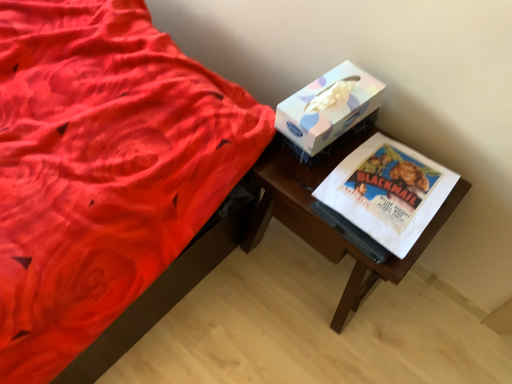
Question: Is white paper at right looking in the opposite direction of wooden table at right?

Choices:
 (A) no
 (B) yes

Answer: (A)

Question: Is there a large distance between white paper at right and wooden table at right?

Choices:
 (A) no
 (B) yes

Answer: (A)

Question: Can you confirm if white paper at right is bigger than wooden table at right?

Choices:
 (A) yes
 (B) no

Answer: (B)

Question: From a real-world perspective, is white paper at right over wooden table at right?

Choices:
 (A) yes
 (B) no

Answer: (A)

Question: From a real-world perspective, is white paper at right located beneath wooden table at right?

Choices:
 (A) yes
 (B) no

Answer: (B)

Question: In the image, is pastel paper tissue box at upper right on the left side or the right side of wooden table at right?

Choices:
 (A) left
 (B) right

Answer: (A)

Question: Do you think pastel paper tissue box at upper right is within wooden table at right, or outside of it?

Choices:
 (A) inside
 (B) outside

Answer: (B)

Question: From a real-world perspective, relative to wooden table at right, is pastel paper tissue box at upper right vertically above or below?

Choices:
 (A) below
 (B) above

Answer: (B)

Question: Is point (321, 135) closer or farther from the camera than point (366, 283)?

Choices:
 (A) farther
 (B) closer

Answer: (B)

Question: From a real-world perspective, is pastel paper tissue box at upper right above or below white paper at right?

Choices:
 (A) below
 (B) above

Answer: (B)

Question: Considering the relative positions of pastel paper tissue box at upper right and white paper at right in the image provided, is pastel paper tissue box at upper right to the left or to the right of white paper at right?

Choices:
 (A) right
 (B) left

Answer: (B)

Question: Relative to white paper at right, is pastel paper tissue box at upper right in front or behind?

Choices:
 (A) front
 (B) behind

Answer: (B)

Question: Is pastel paper tissue box at upper right inside the boundaries of white paper at right, or outside?

Choices:
 (A) inside
 (B) outside

Answer: (B)

Question: Considering the positions of point (376, 205) and point (300, 137), is point (376, 205) closer or farther from the camera than point (300, 137)?

Choices:
 (A) farther
 (B) closer

Answer: (B)

Question: Considering their positions, is white paper at right located in front of or behind pastel paper tissue box at upper right?

Choices:
 (A) behind
 (B) front

Answer: (B)